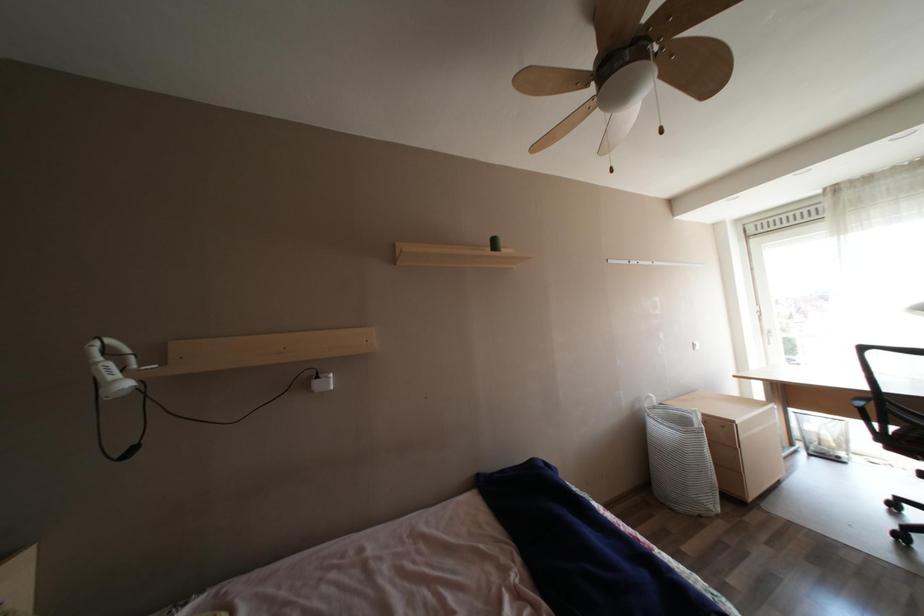
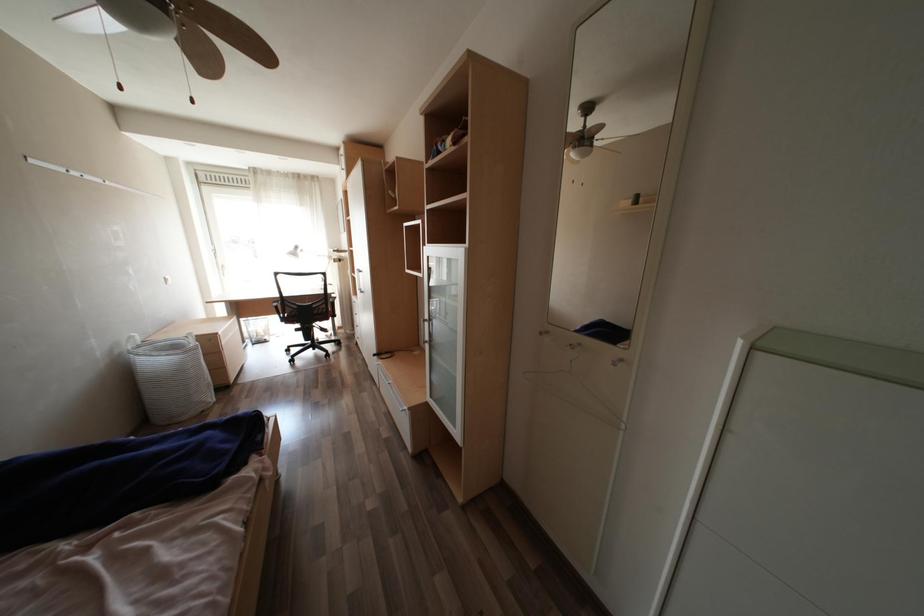
Question: The first image is from the beginning of the video and the second image is from the end. How did the camera likely rotate when shooting the video?

Choices:
 (A) Left
 (B) Right
 (C) Up
 (D) Down

Answer: (B)